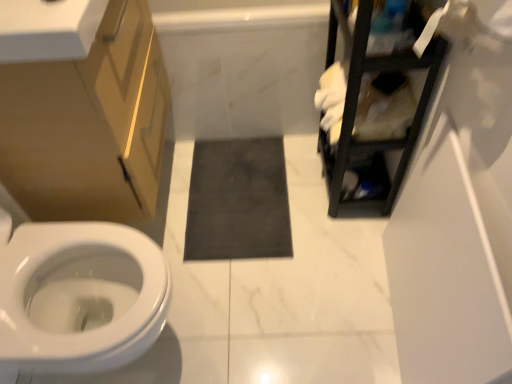
Locate an element on the screen. The height and width of the screenshot is (384, 512). empty space that is in between white marble bath at center and black metal shelving unit at upper right is located at coordinates [x=263, y=167].